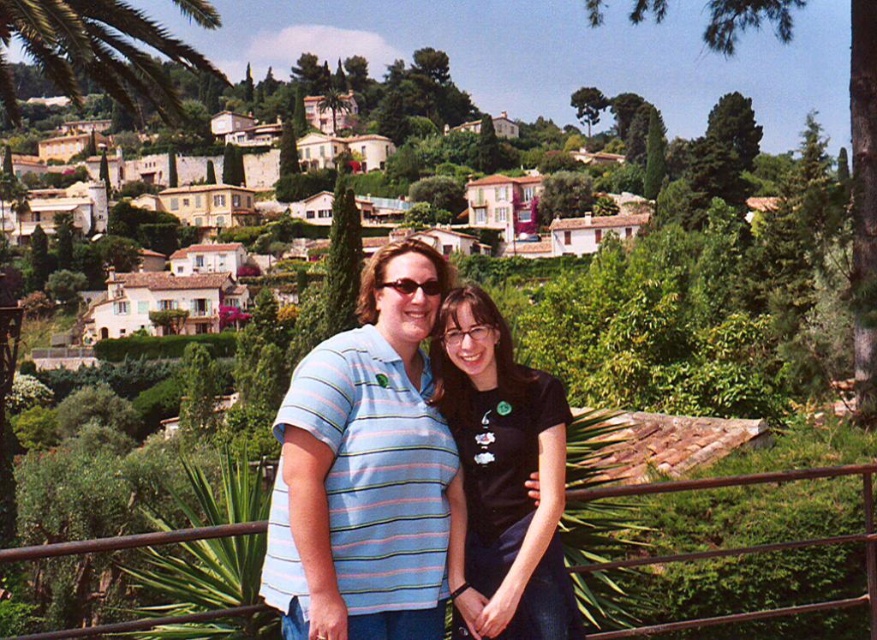
Question: Does black matte shirt at center have a greater width compared to brown metal fence at center?

Choices:
 (A) no
 (B) yes

Answer: (A)

Question: Observing the image, what is the correct spatial positioning of green leafy palm tree at upper left in reference to brown metal fence at center?

Choices:
 (A) below
 (B) above

Answer: (B)

Question: Is green leafy palm tree at upper left further to camera compared to brown metal fence at center?

Choices:
 (A) yes
 (B) no

Answer: (A)

Question: Which of the following is the closest to the observer?

Choices:
 (A) striped cotton shirt at center
 (B) brown metal fence at center

Answer: (B)

Question: Among these objects, which one is farthest from the camera?

Choices:
 (A) brown metal fence at center
 (B) striped cotton shirt at center

Answer: (B)

Question: Which object is the farthest from the striped cotton shirt at center?

Choices:
 (A) brown metal fence at center
 (B) black matte shirt at center
 (C) green leafy palm tree at upper left

Answer: (C)